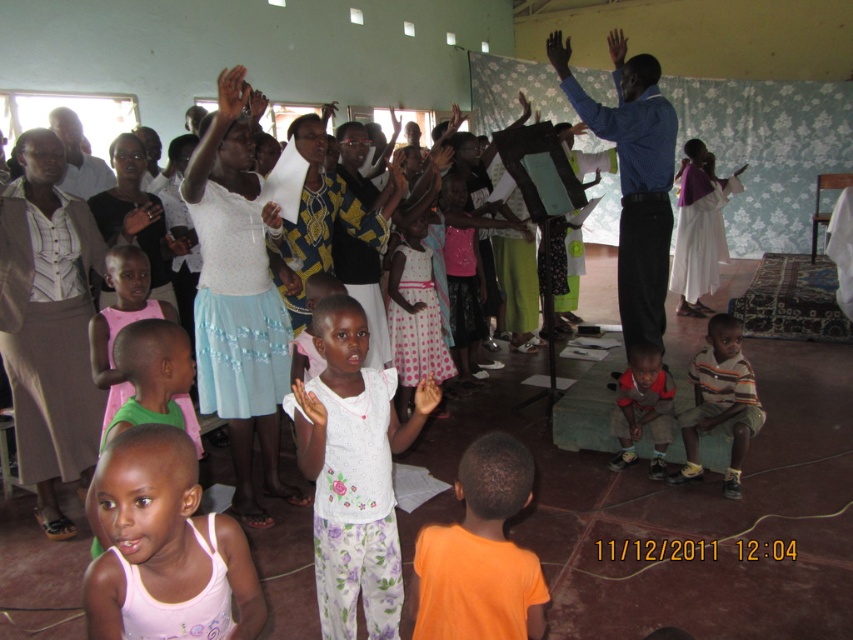
Question: Does white cotton shirt at center have a larger size compared to smooth skin hand at center?

Choices:
 (A) yes
 (B) no

Answer: (A)

Question: Which object is the closest to the matte black hand at upper center?

Choices:
 (A) blue shirt at center
 (B) white cotton shirt at center

Answer: (A)

Question: Does blue shirt at center appear under pink fabric dress at lower left?

Choices:
 (A) yes
 (B) no

Answer: (B)

Question: Among these points, which one is nearest to the camera?

Choices:
 (A) (619, 196)
 (B) (683, 163)
 (C) (635, 429)
 (D) (236, 116)

Answer: (D)

Question: Is the position of white cotton shirt at center more distant than that of red shirt at center?

Choices:
 (A) no
 (B) yes

Answer: (A)

Question: Which object is farther from the camera taking this photo?

Choices:
 (A) white cloth at center
 (B) smooth skin hand at upper center
 (C) matte black hand at upper center

Answer: (A)